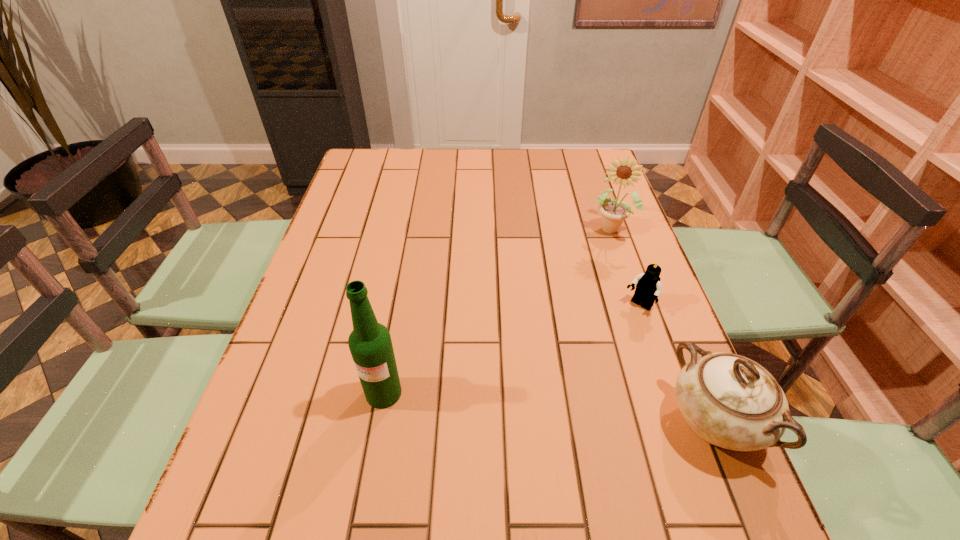
The image size is (960, 540). Identify the location of vacant point located between the beer bottle and the shortest object. (512, 349).

At what (x,y) coordinates should I click in order to perform the action: click on unoccupied area between the tallest object and the sunflower. Please return your answer as a coordinate pair (x, y). Image resolution: width=960 pixels, height=540 pixels. Looking at the image, I should click on (496, 311).

Find the location of `free space between the third nearest object and the tallest object`. free space between the third nearest object and the tallest object is located at coordinates (512, 349).

In order to click on free space between the farthest object and the chinaware in this screenshot , I will do `click(661, 325)`.

This screenshot has height=540, width=960. Identify the location of vacant area that lies between the beer bottle and the second tallest object. coord(496,311).

At what (x,y) coordinates should I click in order to perform the action: click on unoccupied area between the shortest object and the tallest object. Please return your answer as a coordinate pair (x, y). Looking at the image, I should click on (512, 349).

Locate which object ranks third in proximity to the shortest object. Please provide its 2D coordinates. Your answer should be formatted as a tuple, i.e. [(x, y)], where the tuple contains the x and y coordinates of a point satisfying the conditions above.

[(370, 344)]

What are the coordinates of `object that is the third closest one to the sunflower` in the screenshot? It's located at (370, 344).

Locate an element on the screen. This screenshot has width=960, height=540. vacant space that satisfies the following two spatial constraints: 1. on the label of the leftmost object; 2. on the right side of the chinaware is located at coordinates (379, 421).

At what (x,y) coordinates should I click in order to perform the action: click on vacant space that satisfies the following two spatial constraints: 1. on the front side of the third nearest object; 2. on the right side of the third tallest object. Please return your answer as a coordinate pair (x, y). This screenshot has height=540, width=960. Looking at the image, I should click on (679, 421).